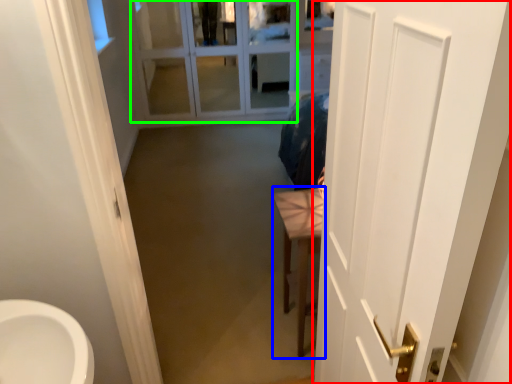
Question: Based on their relative distances, which object is nearer to door (highlighted by a red box)? Choose from furniture (highlighted by a blue box) and glass door (highlighted by a green box).

Choices:
 (A) furniture
 (B) glass door

Answer: (A)